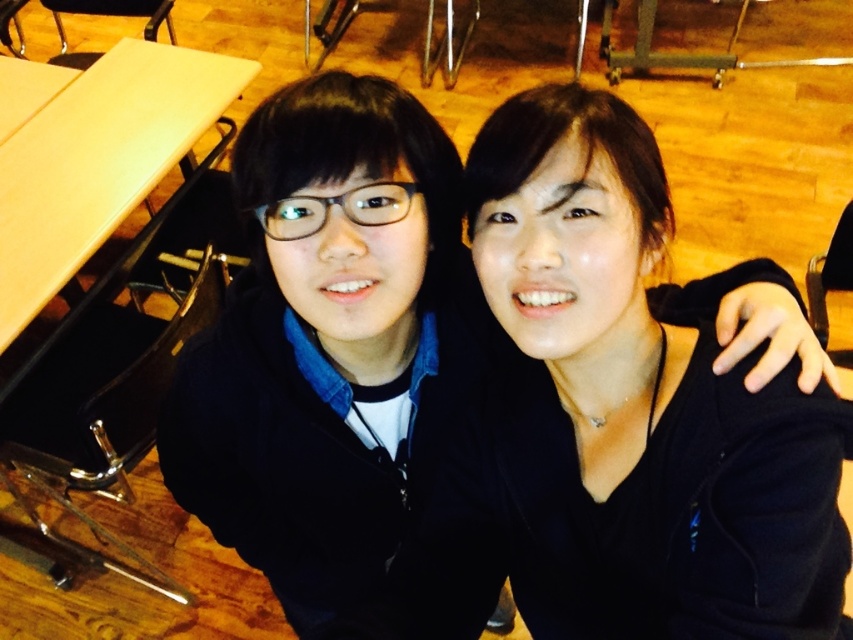
You are a tailor measuring a black matte jacket at center to ensure it fits properly. The tailor also notices a light wood table at upper left nearby. Which object has a smaller width when viewed from above?

The black matte jacket at center is thinner than the light wood table at upper left, so the black matte jacket at center has a smaller width when viewed from above.

You are standing in the room and want to find the exact location of the point at coordinates [635,401]. Based on the scene description, where would this point be located?

The point at coordinates [635,401] is located on the black matte jacket at center.

You are a photographer setting up a shoot in this room. You need to position a 1.5 meter tall tripod between the black matte jacket at center and the light wood table at upper left. Will the tripod be taller than both objects?

The black matte jacket at center has a lesser height compared to light wood table at upper left. Since the tripod is 1.5 meters tall, it will be taller than both objects.